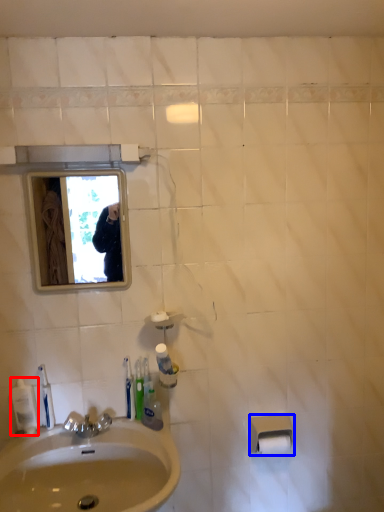
Question: Which object appears closest to the camera in this image, mouthwash (highlighted by a red box) or toilet paper (highlighted by a blue box)?

Choices:
 (A) mouthwash
 (B) toilet paper

Answer: (A)